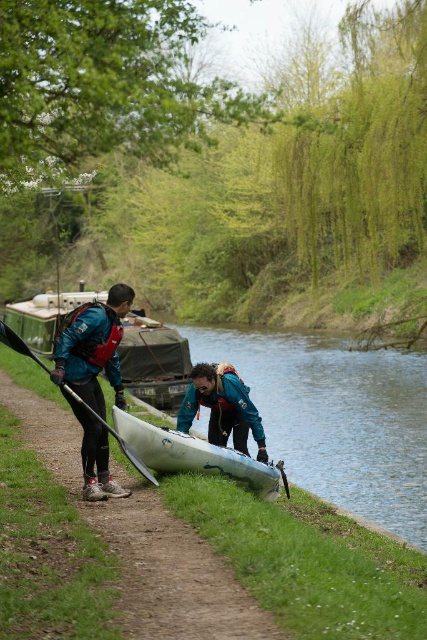
Between matte blue kayak at lower center and white plastic canoe at lower center, which one has more height?

With more height is white plastic canoe at lower center.

Describe the element at coordinates (145, 541) in the screenshot. The image size is (427, 640). I see `matte blue kayak at lower center` at that location.

This screenshot has width=427, height=640. Identify the location of matte blue kayak at lower center. (145, 541).

Who is taller, matte blue kayak at lower center or matte blue jacket at left?

matte blue jacket at left is taller.

Does matte blue kayak at lower center have a greater height compared to matte blue jacket at left?

Incorrect, matte blue kayak at lower center's height is not larger of matte blue jacket at left's.

Which is behind, point (233, 600) or point (90, 333)?

Point (90, 333)

Find the location of a particular element. matte blue kayak at lower center is located at coordinates (145, 541).

Based on the photo, which is above, matte green boat at center or white plastic canoe at lower center?

Positioned higher is matte green boat at center.

Which is behind, point (146, 372) or point (148, 444)?

Point (146, 372)

Which is in front, point (132, 349) or point (175, 435)?

Positioned in front is point (175, 435).

At what (x,y) coordinates should I click in order to perform the action: click on matte green boat at center. Please return your answer as a coordinate pair (x, y). Looking at the image, I should click on (154, 362).